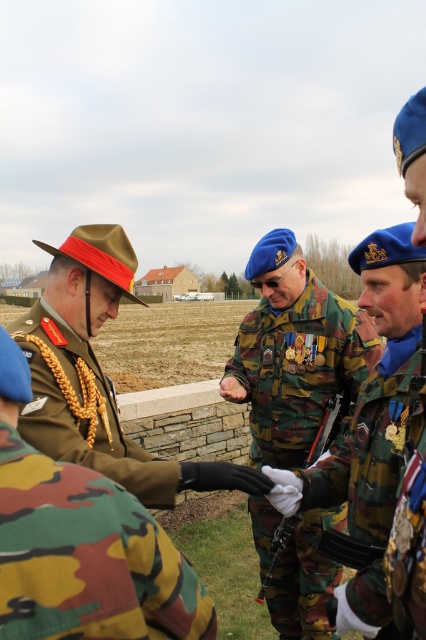
You are a photographer positioned at the origin point of the coordinate system. You need to capture a photo of the camo fabric uniform at center. What are the coordinates where you should aim your camera?

The coordinates to aim your camera are at point (86, 557) where the camo fabric uniform at center is located.

You are a photographer at the event and need to capture a wide shot of both the camo fabric uniform at center and the camouflage uniform at center. Given their widths, which one should you frame first to ensure both fit in the photo?

The camo fabric uniform at center is narrower than the camouflage uniform at center, so you should frame the wider camouflage uniform at center first to ensure both fit in the photo.